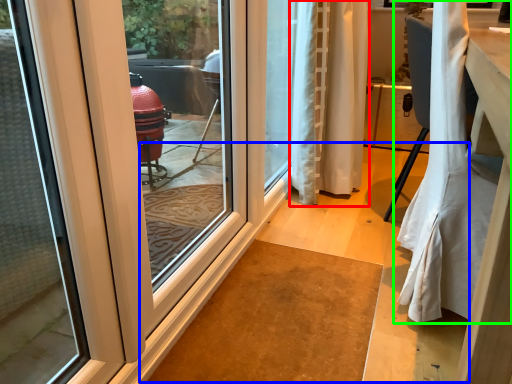
Question: Which object is positioned closest to curtain (highlighted by a red box)? Select from path (highlighted by a blue box) and curtain (highlighted by a green box).

Choices:
 (A) path
 (B) curtain

Answer: (A)